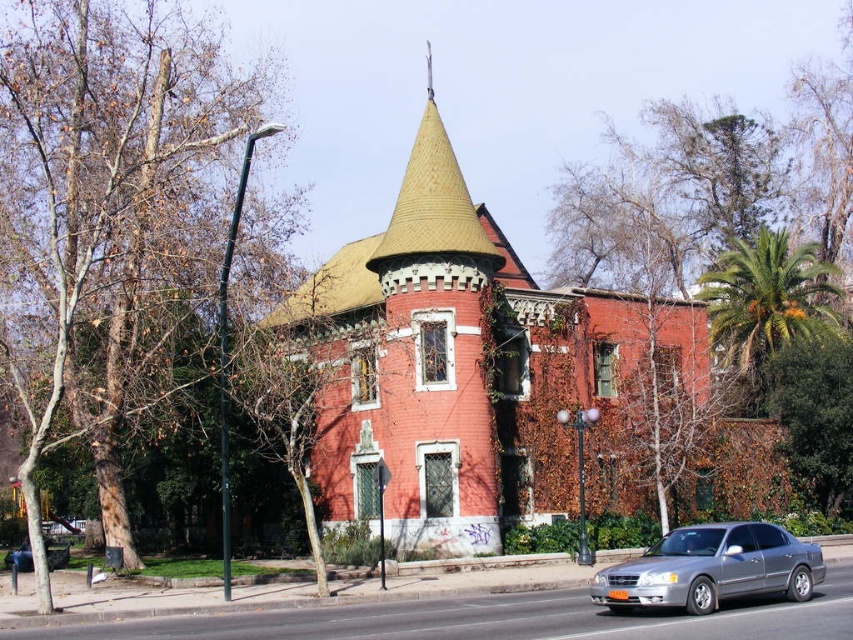
Question: Does yellow shingled spire at upper center lie behind metallic silver sedan at center?

Choices:
 (A) yes
 (B) no

Answer: (A)

Question: Which of the following is the closest to the observer?

Choices:
 (A) (45, 545)
 (B) (724, 547)
 (C) (421, 120)

Answer: (B)

Question: Can you confirm if silver metallic sedan at lower center is positioned below yellow shingled spire at upper center?

Choices:
 (A) yes
 (B) no

Answer: (A)

Question: Is yellow shingled spire at upper center to the right of metallic silver sedan at center from the viewer's perspective?

Choices:
 (A) no
 (B) yes

Answer: (B)

Question: Among these points, which one is farthest from the camera?

Choices:
 (A) (440, 209)
 (B) (49, 557)

Answer: (B)

Question: Which of the following is the farthest from the observer?

Choices:
 (A) metallic silver sedan at center
 (B) silver metallic sedan at lower center

Answer: (A)